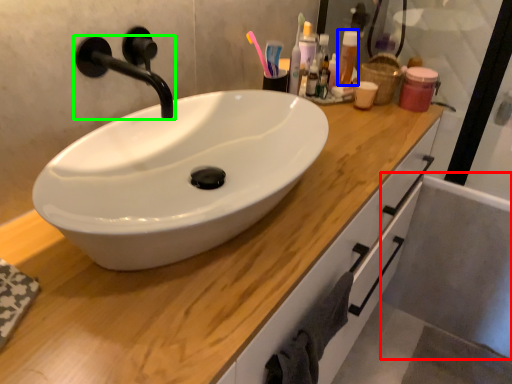
Question: Estimate the real-world distances between objects in this image. Which object is farther from bath (highlighted by a red box), toiletry (highlighted by a blue box) or tap (highlighted by a green box)?

Choices:
 (A) toiletry
 (B) tap

Answer: (B)